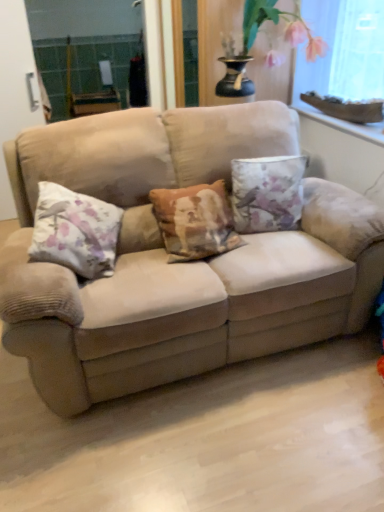
Image resolution: width=384 pixels, height=512 pixels. What do you see at coordinates (344, 58) in the screenshot? I see `transparent plastic window screen at upper right` at bounding box center [344, 58].

Locate an element on the screen. The width and height of the screenshot is (384, 512). floral bouquet at upper right is located at coordinates (264, 30).

In order to face clear glass screen door at left, should I rotate leftwards or rightwards?

Rotate left and turn 22.886 degrees.

Locate an element on the screen. This screenshot has width=384, height=512. transparent plastic window screen at upper right is located at coordinates (344, 58).

Which object is further away from the camera, clear glass screen door at left or floral fabric cushion at center, the 2th pillow in the left-to-right sequence?

clear glass screen door at left.

From the image's perspective, is clear glass screen door at left over floral fabric cushion at center, the 2th pillow in the left-to-right sequence?

Indeed, from the image's perspective, clear glass screen door at left is shown above floral fabric cushion at center, the 2th pillow in the left-to-right sequence.

The image size is (384, 512). In order to click on pillow on the left of the floral fabric cushion at center, which appears as the first pillow when viewed from the right in this screenshot , I will do `click(75, 231)`.

What's the angular difference between floral fabric cushion at left, the second pillow viewed from the right, and floral fabric cushion at center, which appears as the first pillow when viewed from the right,'s facing directions?

They differ by 4.51 degrees in their facing directions.

Could you tell me if floral fabric cushion at left, the second pillow viewed from the right, is facing floral fabric cushion at center, the 2th pillow in the left-to-right sequence?

No, floral fabric cushion at left, the second pillow viewed from the right, is not oriented towards floral fabric cushion at center, the 2th pillow in the left-to-right sequence.

Is clear glass screen door at left in front of white stone window sill at upper right?

No.

Is clear glass screen door at left looking in the opposite direction of white stone window sill at upper right?

That's not correct — clear glass screen door at left is not looking away from white stone window sill at upper right.

Are clear glass screen door at left and white stone window sill at upper right far apart?

That's right, there is a large distance between clear glass screen door at left and white stone window sill at upper right.

Considering the sizes of objects transparent plastic window screen at upper right and clear glass screen door at left in the image provided, who is thinner, transparent plastic window screen at upper right or clear glass screen door at left?

clear glass screen door at left.

From the image's perspective, between transparent plastic window screen at upper right and clear glass screen door at left, which one is located above?

transparent plastic window screen at upper right appears higher in the image.

From a real-world perspective, which is physically below, transparent plastic window screen at upper right or clear glass screen door at left?

In real-world perspective, clear glass screen door at left is lower.

Is transparent plastic window screen at upper right not near clear glass screen door at left?

Yes, transparent plastic window screen at upper right and clear glass screen door at left are quite far apart.

Does floral bouquet at upper right have a lesser width compared to beige fabric couch at center?

Yes, floral bouquet at upper right is thinner than beige fabric couch at center.

Is floral bouquet at upper right looking in the opposite direction of beige fabric couch at center?

No, beige fabric couch at center is not at the back of floral bouquet at upper right.

Where is `studio couch located underneath the floral bouquet at upper right (from a real-world perspective)`? Image resolution: width=384 pixels, height=512 pixels. studio couch located underneath the floral bouquet at upper right (from a real-world perspective) is located at coordinates (177, 264).

Does floral bouquet at upper right have a lesser height compared to beige fabric couch at center?

Indeed, floral bouquet at upper right has a lesser height compared to beige fabric couch at center.

Considering their positions, is clear glass screen door at left located in front of or behind transparent plastic window screen at upper right?

clear glass screen door at left is positioned farther from the viewer than transparent plastic window screen at upper right.

From a real-world perspective, is clear glass screen door at left on top of transparent plastic window screen at upper right?

Actually, clear glass screen door at left is physically below transparent plastic window screen at upper right in the real world.

From the image's perspective, is clear glass screen door at left located beneath transparent plastic window screen at upper right?

Yes, from the image's perspective, clear glass screen door at left is below transparent plastic window screen at upper right.

Is clear glass screen door at left wider or thinner than transparent plastic window screen at upper right?

Considering their sizes, clear glass screen door at left looks slimmer than transparent plastic window screen at upper right.

Is point (309, 113) positioned in front of point (93, 248)?

No, it is not.

From a real-world perspective, between white stone window sill at upper right and floral fabric cushion at left, the first pillow when ordered from left to right, who is vertically higher?

white stone window sill at upper right.

From the image's perspective, which is below, white stone window sill at upper right or floral fabric cushion at left, the second pillow viewed from the right?

From the image's view, floral fabric cushion at left, the second pillow viewed from the right, is below.

Where is `screen door above the floral fabric cushion at center, the 2th pillow in the left-to-right sequence (from the image's perspective)`? This screenshot has height=512, width=384. screen door above the floral fabric cushion at center, the 2th pillow in the left-to-right sequence (from the image's perspective) is located at coordinates (15, 88).

There is a floral fabric cushion at left, the first pillow when ordered from left to right. What are the coordinates of `pillow above it (from a real-world perspective)` in the screenshot? It's located at (267, 193).

Estimate the real-world distances between objects in this image. Which object is further from floral fabric cushion at center, which appears as the first pillow when viewed from the right, floral fabric cushion at left, the first pillow when ordered from left to right, or transparent plastic window screen at upper right?

The object further to floral fabric cushion at center, which appears as the first pillow when viewed from the right, is floral fabric cushion at left, the first pillow when ordered from left to right.

Based on their spatial positions, is beige fabric couch at center or white stone window sill at upper right closer to floral bouquet at upper right?

Among the two, white stone window sill at upper right is located nearer to floral bouquet at upper right.

Estimate the real-world distances between objects in this image. Which object is closer to transparent plastic window screen at upper right, floral fabric cushion at center, which appears as the first pillow when viewed from the right, or floral fabric cushion at left, the first pillow when ordered from left to right?

The object closer to transparent plastic window screen at upper right is floral fabric cushion at center, which appears as the first pillow when viewed from the right.

Estimate the real-world distances between objects in this image. Which object is further from clear glass screen door at left, floral bouquet at upper right or beige fabric couch at center?

floral bouquet at upper right lies further to clear glass screen door at left than the other object.

Estimate the real-world distances between objects in this image. Which object is closer to transparent plastic window screen at upper right, white stone window sill at upper right or floral fabric cushion at left, the second pillow viewed from the right?

Based on the image, white stone window sill at upper right appears to be nearer to transparent plastic window screen at upper right.

Looking at the image, which one is located closer to floral fabric cushion at center, the 2th pillow in the left-to-right sequence, floral bouquet at upper right or beige fabric couch at center?

The object closer to floral fabric cushion at center, the 2th pillow in the left-to-right sequence, is beige fabric couch at center.

Looking at the image, which one is located further to floral fabric cushion at left, the second pillow viewed from the right, transparent plastic window screen at upper right or floral bouquet at upper right?

The object further to floral fabric cushion at left, the second pillow viewed from the right, is transparent plastic window screen at upper right.

From the image, which object appears to be nearer to clear glass screen door at left, beige fabric couch at center or floral fabric cushion at left, the second pillow viewed from the right?

floral fabric cushion at left, the second pillow viewed from the right, is positioned closer to the anchor clear glass screen door at left.

Locate an element on the screen. pillow situated between floral fabric cushion at left, the first pillow when ordered from left to right, and floral bouquet at upper right from left to right is located at coordinates (267, 193).

Identify the location of studio couch between clear glass screen door at left and floral bouquet at upper right from left to right. The image size is (384, 512). (177, 264).

Locate an element on the screen. window sill between transparent plastic window screen at upper right and floral fabric cushion at center, the 2th pillow in the left-to-right sequence, vertically is located at coordinates (343, 123).

Locate an element on the screen. The image size is (384, 512). pillow that lies between transparent plastic window screen at upper right and beige fabric couch at center from top to bottom is located at coordinates (267, 193).